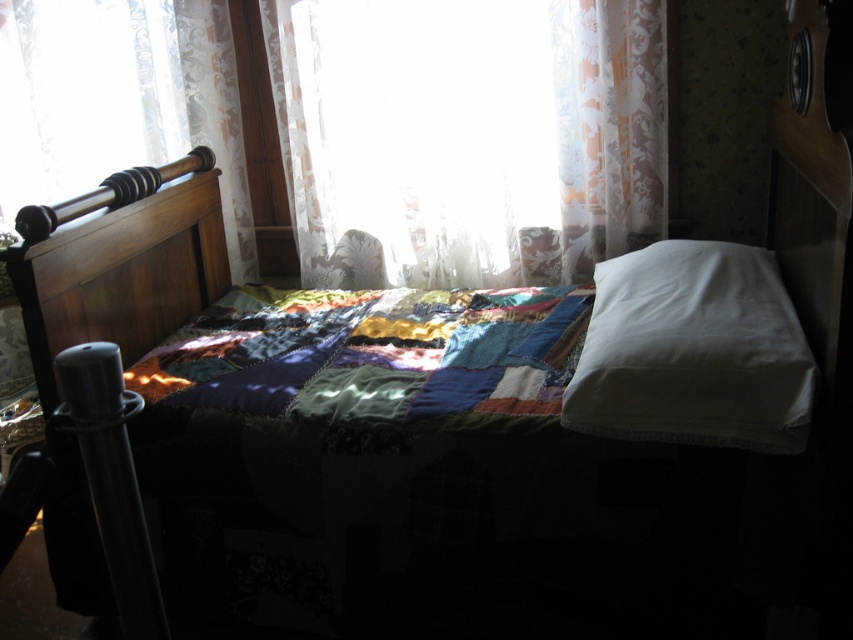
Which is behind, point (289, 188) or point (532, 342)?

The point (289, 188) is behind.

Can you confirm if translucent floral fabric at center is wider than patchwork fabric quilt at center?

Correct, the width of translucent floral fabric at center exceeds that of patchwork fabric quilt at center.

Is point (526, 209) positioned in front of point (189, 371)?

No.

Where is `translucent floral fabric at center`? This screenshot has height=640, width=853. translucent floral fabric at center is located at coordinates [x=468, y=136].

Can you confirm if translucent floral fabric at center is thinner than white smooth pillow at center?

No, translucent floral fabric at center is not thinner than white smooth pillow at center.

What do you see at coordinates (468, 136) in the screenshot?
I see `translucent floral fabric at center` at bounding box center [468, 136].

Between point (618, 253) and point (688, 248), which one is positioned in front?

Point (688, 248) is in front.

At what (x,y) coordinates should I click in order to perform the action: click on translucent floral fabric at center. Please return your answer as a coordinate pair (x, y). Looking at the image, I should click on (468, 136).

Between patchwork fabric quilt at center and wooden headboard at left, which one has less height?

patchwork fabric quilt at center is shorter.

Which is behind, point (567, 301) or point (166, 275)?

Point (166, 275)

Identify the location of patchwork fabric quilt at center. (373, 356).